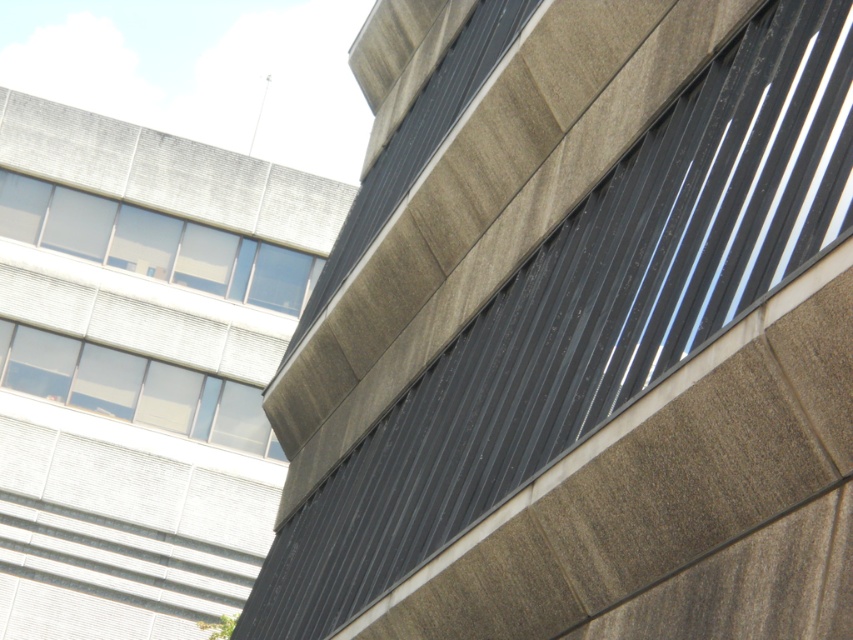
You are standing at a point 44.90 meters away from the point marked at coordinates point (59,205). Describe your view of the two buildings in the image from this position.

From your position 44.90 meters away from the point marked at coordinates point (59,205), you would see the modern building on the right with its dark, ribbed metal facade and the traditional building on the left with its lighter, windowed exterior. The point is part of the modern building, as it is closer to the right side of the image.

You are an architect reviewing the design of the two adjacent buildings. You notice the clear glass windows at upper left and the clear glass window at upper left. Which one is positioned higher in the structure?

The clear glass windows at upper left is positioned higher in the structure than the clear glass window at upper left.

You are a photographer standing in front of the two buildings. You want to focus on the point closer to you. Which point should you choose between point (112, 227) and point (184, 422)?

Point (112, 227) is further to the camera than point (184, 422), so you should choose point (112, 227) as it is closer to you.